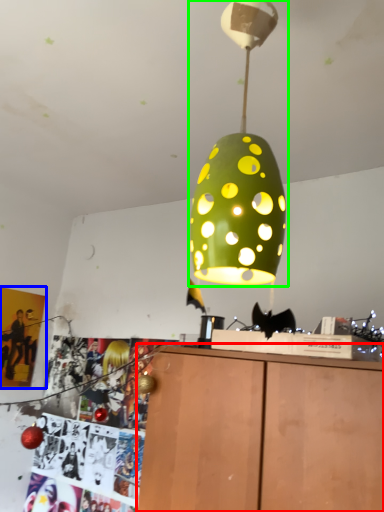
Question: Estimate the real-world distances between objects in this image. Which object is farther from furniture (highlighted by a red box), poster page (highlighted by a blue box) or lamp (highlighted by a green box)?

Choices:
 (A) poster page
 (B) lamp

Answer: (A)